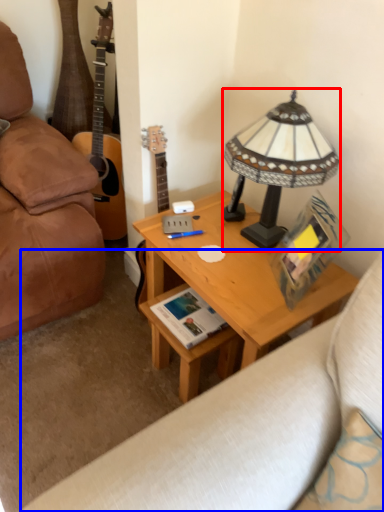
Question: Which object is closer to the camera taking this photo, lamp (highlighted by a red box) or studio couch (highlighted by a blue box)?

Choices:
 (A) lamp
 (B) studio couch

Answer: (A)